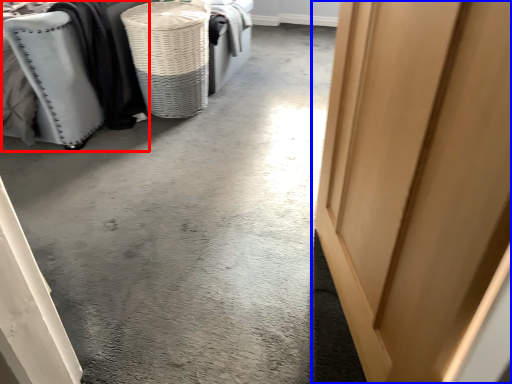
Question: Which of the following is the closest to the observer, furniture (highlighted by a red box) or door (highlighted by a blue box)?

Choices:
 (A) furniture
 (B) door

Answer: (B)